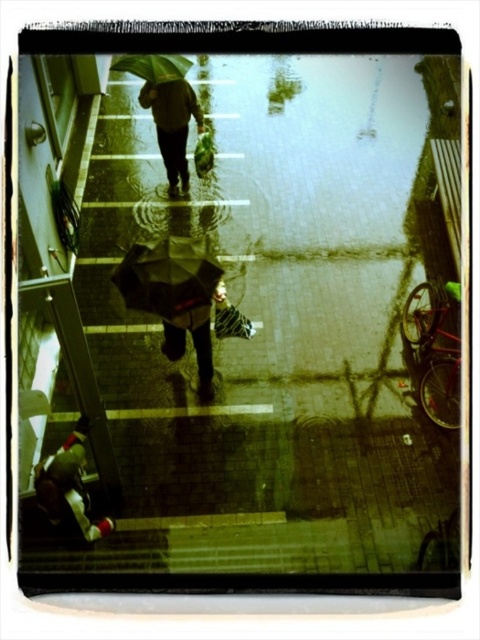
Question: Observing the image, what is the correct spatial positioning of matte black umbrella at upper center in reference to green matte umbrella at upper center?

Choices:
 (A) above
 (B) below

Answer: (B)

Question: Which object is the closest to the red fabric bag at lower left?

Choices:
 (A) matte black umbrella at upper center
 (B) transparent plastic umbrella at center
 (C) green matte umbrella at upper center

Answer: (B)

Question: Can you confirm if red fabric bag at lower left is thinner than green matte umbrella at upper center?

Choices:
 (A) no
 (B) yes

Answer: (B)

Question: Which object appears farthest from the camera in this image?

Choices:
 (A) transparent plastic umbrella at center
 (B) red fabric bag at lower left
 (C) matte black umbrella at upper center
 (D) green matte umbrella at upper center

Answer: (C)

Question: Can you confirm if transparent plastic umbrella at center is positioned to the left of matte black umbrella at upper center?

Choices:
 (A) yes
 (B) no

Answer: (B)

Question: Based on their relative distances, which object is farther from the red fabric bag at lower left?

Choices:
 (A) matte black umbrella at upper center
 (B) transparent plastic umbrella at center

Answer: (A)